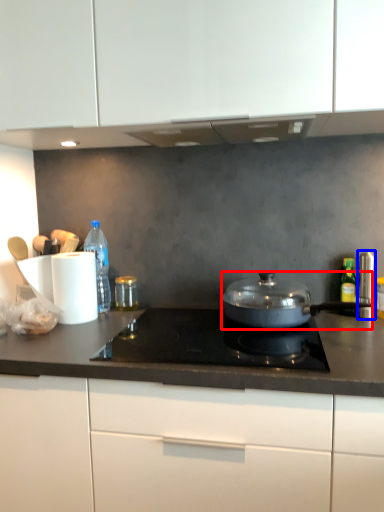
Question: Which object appears closest to the camera in this image, kitchen appliance (highlighted by a red box) or appliance (highlighted by a blue box)?

Choices:
 (A) kitchen appliance
 (B) appliance

Answer: (A)